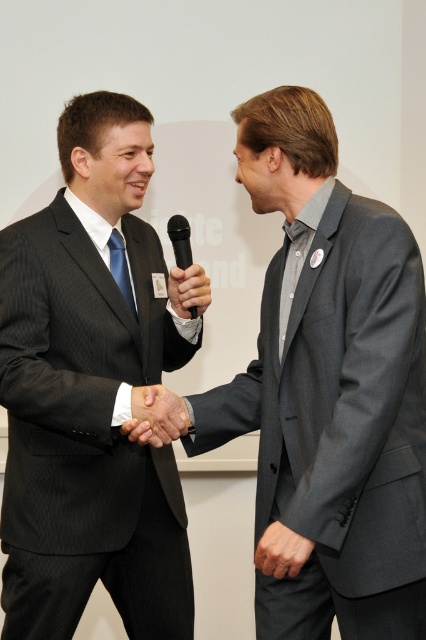
You are observing two men shaking hands in a professional setting. The man on the left is wearing a dark pinstripe suit and holding a microphone, while the man on the right has a gray suit jacket and a lapel pin. Based on their positions, which object from the list is located to the right of the other? The objects are the gray pinstripe suit at center and the matte black hand at center.

The gray pinstripe suit at center is located to the right of the matte black hand at center.

You are a photographer taking a portrait of the two men shaking hands. To ensure the matte black hand at center and the black matte microphone at center are both clearly visible in the frame, which object should you focus on first?

The matte black hand at center is located below the black matte microphone at center, so you should focus on the black matte microphone at center first to ensure both are in clear view.